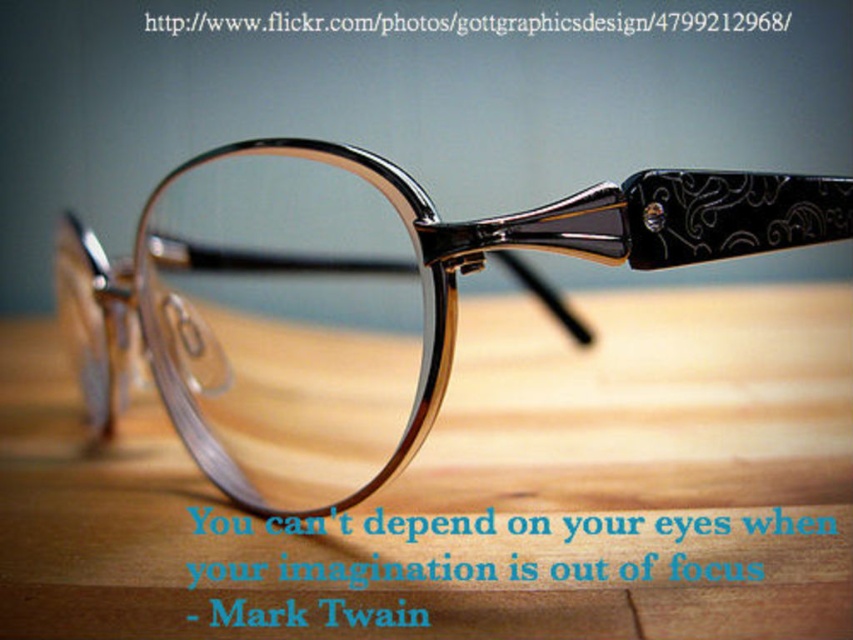
You are a photographer setting up a shot of the wooden table at center and the matte black glasses at center. You need to adjust the camera height to ensure both objects are fully visible in the frame. Which object should you position the camera closer to, and why?

You should position the camera closer to the wooden table at center because it is shorter than the matte black glasses at center, allowing both objects to be fully visible in the frame when the camera is adjusted accordingly.